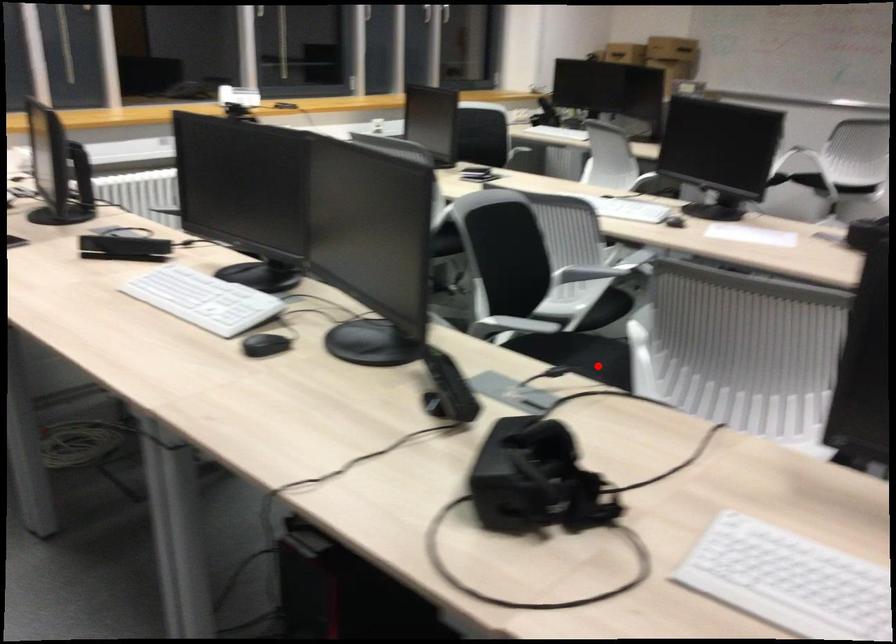
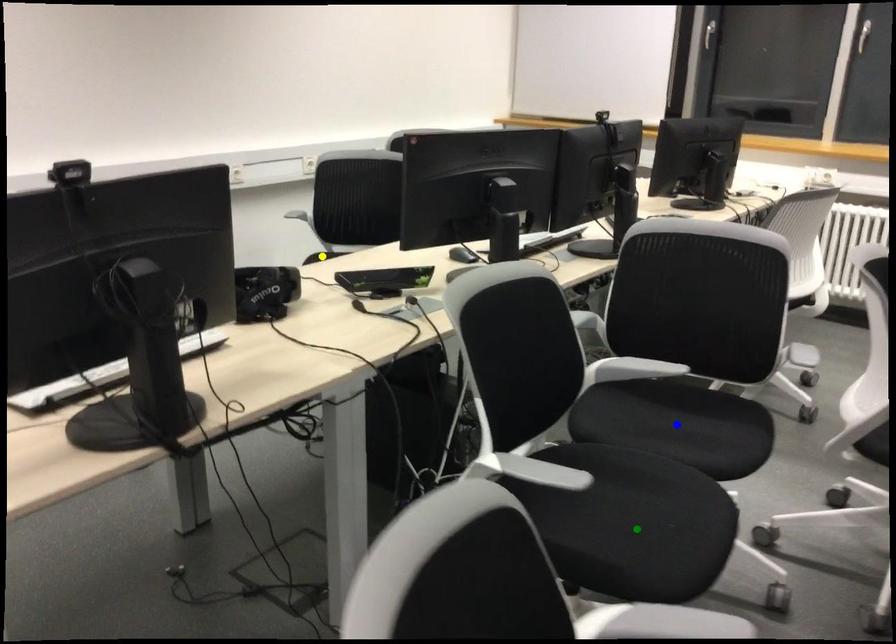
Question: I am providing you with two images of the same scene from different viewpoints. A red point is marked on the first image. You are given multiple points on the second image. Which point in image 2 represents the same 3d spot as the red point in image 1?

Choices:
 (A) yellow point
 (B) blue point
 (C) green point

Answer: (B)